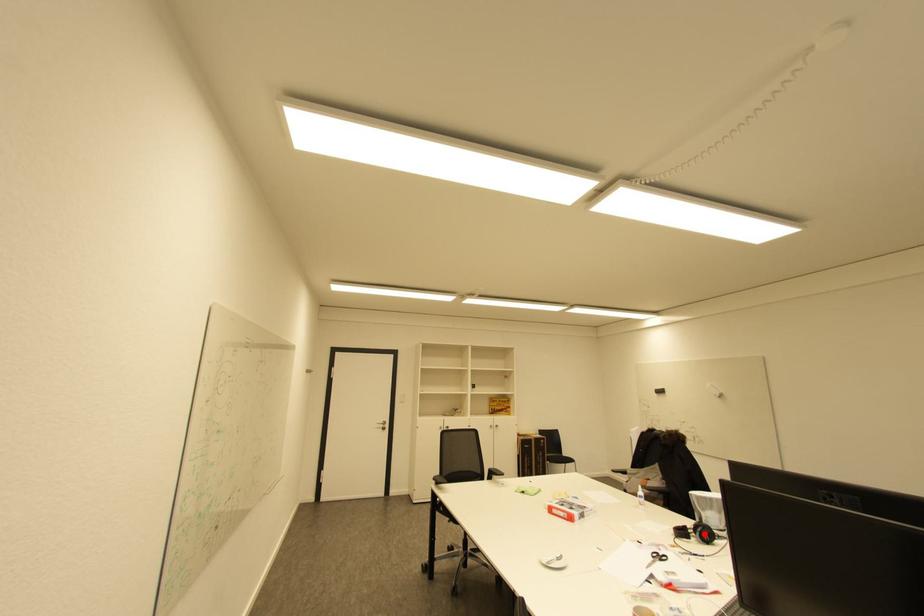
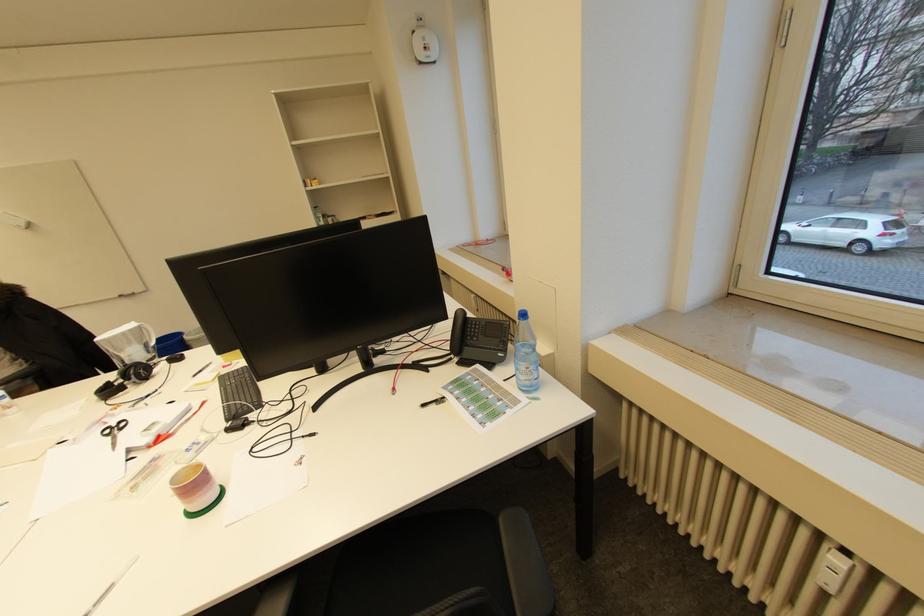
Find the pixel in the second image that matches the highlighted location in the first image.

(140, 377)